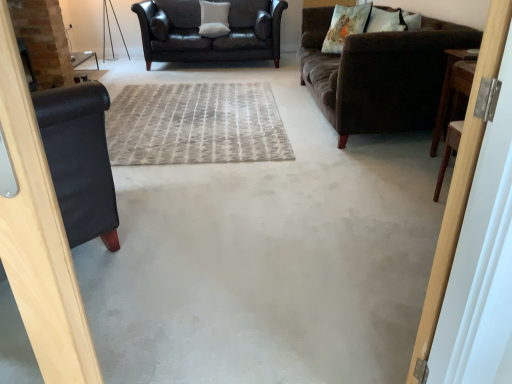
Identify the location of free spot in front of leather couch at upper center, arranged as the second studio couch when viewed from the right. The image size is (512, 384). (204, 87).